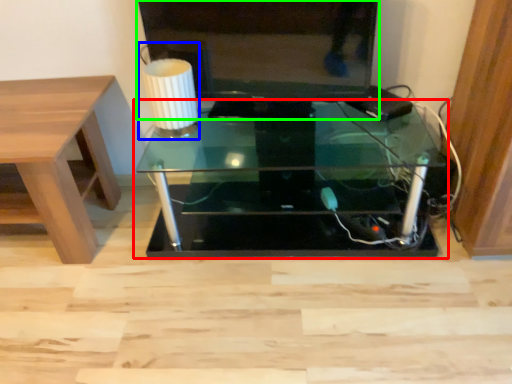
Question: Considering the real-world distances, which object is closest to table (highlighted by a red box)? table lamp (highlighted by a blue box) or television (highlighted by a green box).

Choices:
 (A) table lamp
 (B) television

Answer: (B)